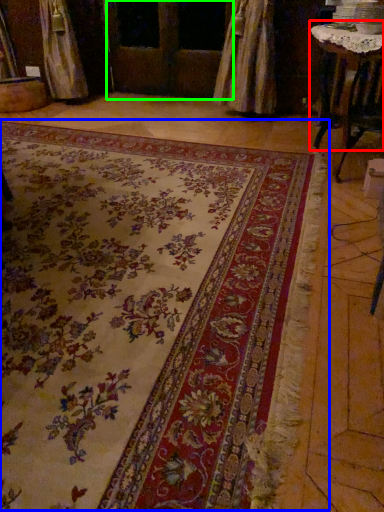
Question: Which object is the closest to the table (highlighted by a red box)? Choose among these: mat (highlighted by a blue box) or screen door (highlighted by a green box).

Choices:
 (A) mat
 (B) screen door

Answer: (A)